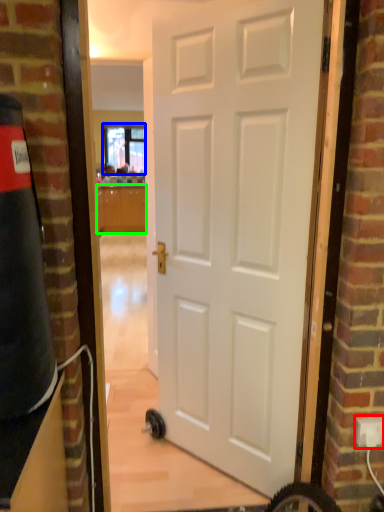
Question: Based on their relative distances, which object is farther from electric outlet (highlighted by a red box)? Choose from window (highlighted by a blue box) and cabinetry (highlighted by a green box).

Choices:
 (A) window
 (B) cabinetry

Answer: (A)